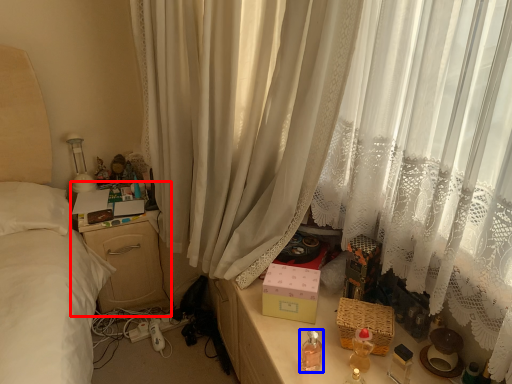
Question: Which of the following is the farthest to the observer, nightstand (highlighted by a red box) or baby bottle (highlighted by a blue box)?

Choices:
 (A) nightstand
 (B) baby bottle

Answer: (A)